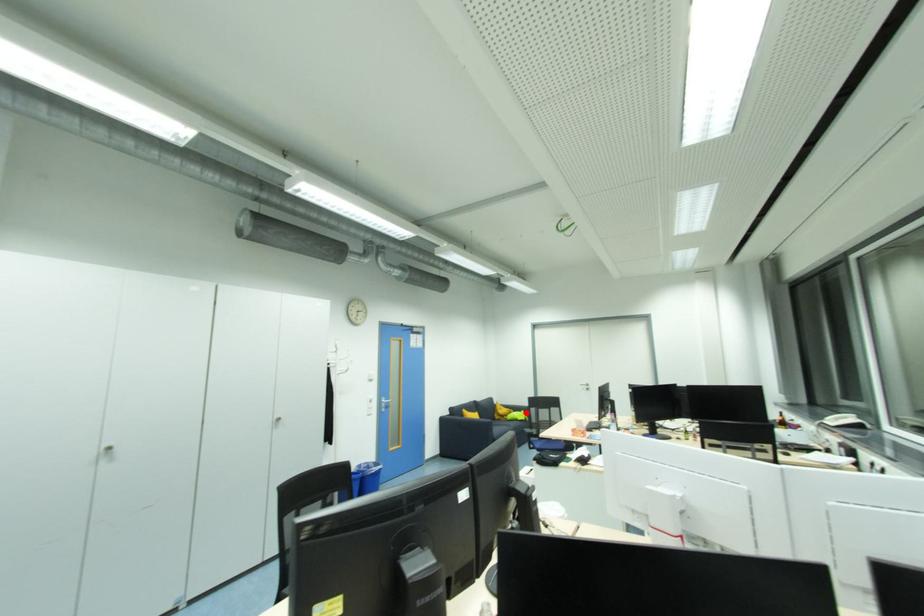
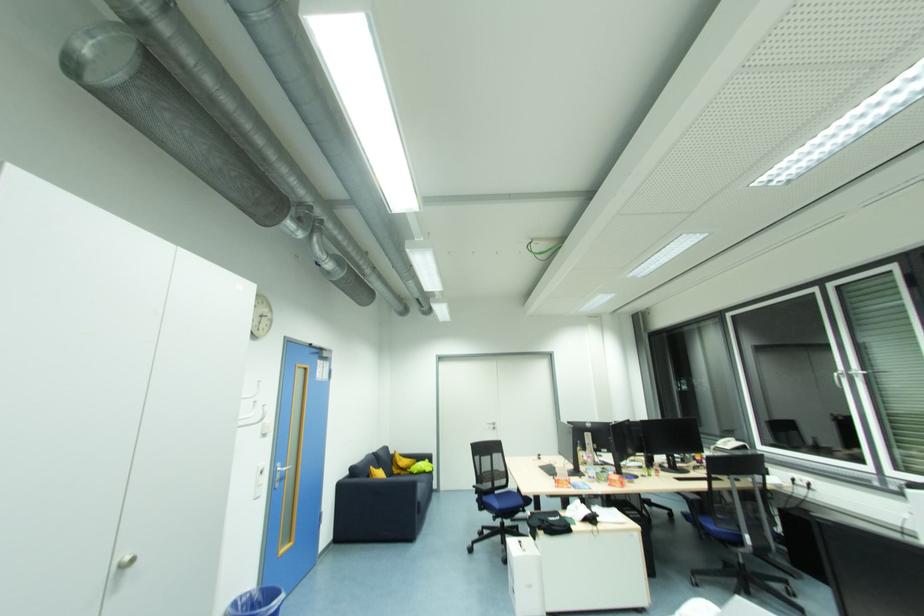
The point at the highlighted location is marked in the first image. Where is the corresponding point in the second image?

(430, 461)